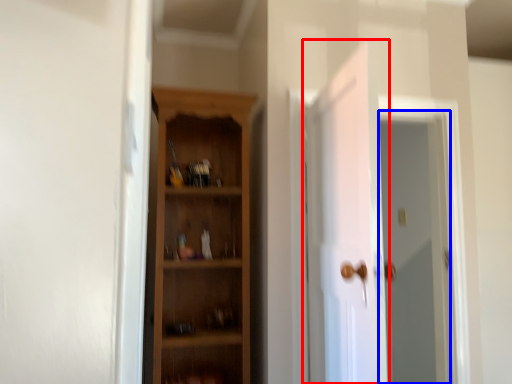
Question: Which of the following is the farthest to the observer, door (highlighted by a red box) or screen door (highlighted by a blue box)?

Choices:
 (A) door
 (B) screen door

Answer: (B)